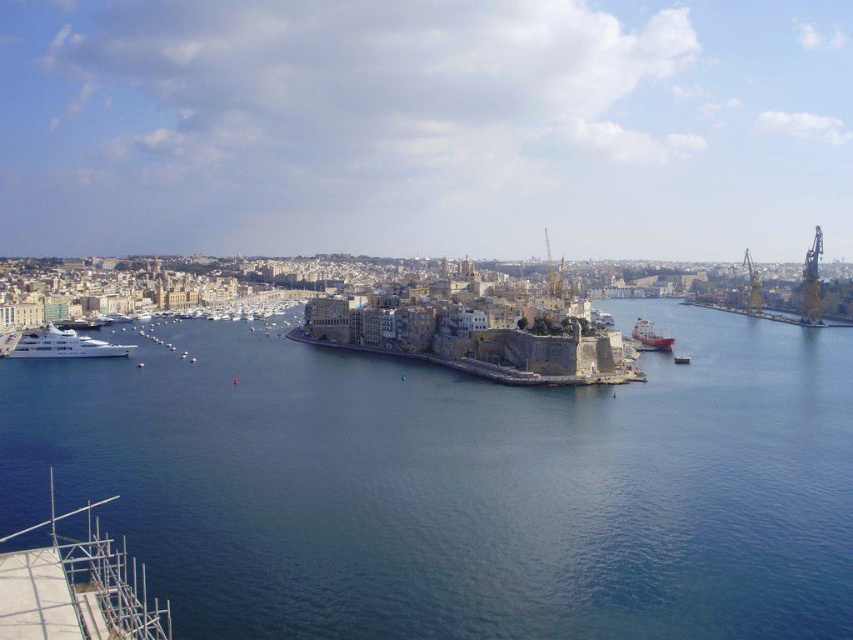
Question: Which point is closer to the camera?

Choices:
 (A) white glossy yacht at lower left
 (B) red matte ship at center

Answer: (A)

Question: Is blue water at center positioned at the back of metallic gray boat at center?

Choices:
 (A) no
 (B) yes

Answer: (A)

Question: Is white glossy yacht at lower left positioned before metallic gray boat at center?

Choices:
 (A) no
 (B) yes

Answer: (B)

Question: Estimate the real-world distances between objects in this image. Which object is closer to the blue water at center?

Choices:
 (A) white glossy yacht at lower left
 (B) yellow metallic crane at right
 (C) red matte ship at center

Answer: (A)

Question: Can you confirm if white glossy yacht at lower left is bigger than yellow metallic crane at right?

Choices:
 (A) no
 (B) yes

Answer: (A)

Question: Which object is the farthest from the white glossy yacht at lower left?

Choices:
 (A) red matte ship at center
 (B) metallic gray boat at center

Answer: (A)